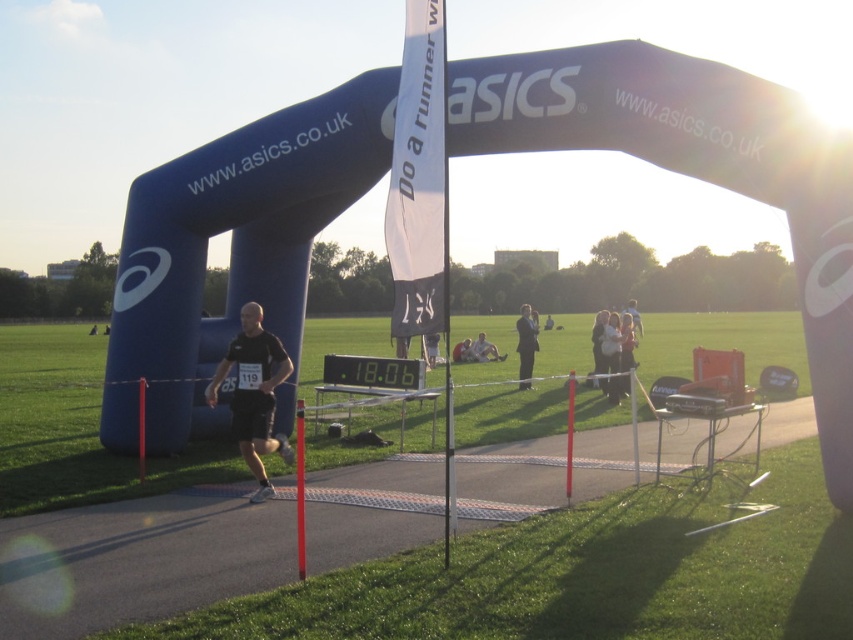
Question: Which point is farther from the camera taking this photo?

Choices:
 (A) (572, 442)
 (B) (238, 408)
 (C) (636, 310)
 (D) (491, 346)

Answer: (D)

Question: Is black matte shorts at center behind dark gray suit at center?

Choices:
 (A) yes
 (B) no

Answer: (B)

Question: Does black matte shorts at center come in front of metallic silver pole at center?

Choices:
 (A) no
 (B) yes

Answer: (A)

Question: Is smooth plastic pole at center to the right of black fabric person at center from the viewer's perspective?

Choices:
 (A) yes
 (B) no

Answer: (A)

Question: Among these points, which one is nearest to the camera?

Choices:
 (A) (238, 401)
 (B) (537, 332)
 (C) (469, 352)

Answer: (A)

Question: Which of the following is the closest to the observer?

Choices:
 (A) metallic silver pole at center
 (B) black fabric person at center

Answer: (A)